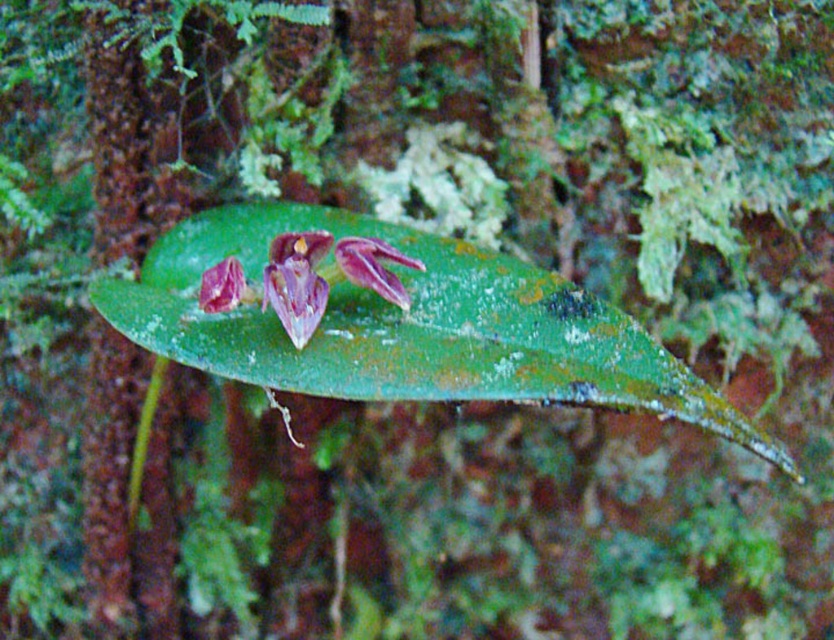
You are a botanist studying the leaf and its flowers. You notice two points marked on the leaf. Which point is closer to you, point [302,342] or point [230,269]?

Point [302,342] is in front of point [230,269], so it is closer to you.

You are a botanist examining a leaf with two types of purple flowers. You notice the purple matte orchid at center and the matte purple orchid at center. Which one is positioned higher on the leaf?

The purple matte orchid at center is positioned higher than the matte purple orchid at center on the leaf.